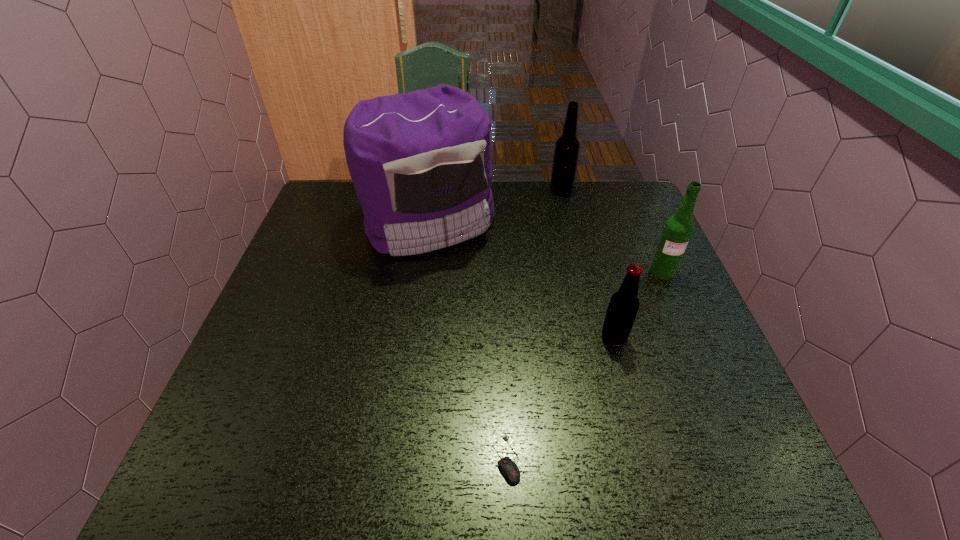
Where is `free space between the nearest object and the rightmost object`? free space between the nearest object and the rightmost object is located at coordinates (585, 365).

The height and width of the screenshot is (540, 960). I want to click on vacant region between the nearest beer bottle and the farthest beer bottle, so click(588, 264).

You are a GUI agent. You are given a task and a screenshot of the screen. Output one action in this format:
    pyautogui.click(x=<x>, y=<y>)
    Task: Click on the vacant region between the mouse and the rightmost beer bottle
    
    Given the screenshot: What is the action you would take?
    pyautogui.click(x=585, y=365)

Locate an element on the screen. The height and width of the screenshot is (540, 960). free space between the farthest beer bottle and the rightmost beer bottle is located at coordinates (612, 231).

Select which object is the closest to the shortest beer bottle. Please provide its 2D coordinates. Your answer should be formatted as a tuple, i.e. [(x, y)], where the tuple contains the x and y coordinates of a point satisfying the conditions above.

[(678, 229)]

Identify which object is the fourth nearest to the farthest beer bottle. Please provide its 2D coordinates. Your answer should be formatted as a tuple, i.e. [(x, y)], where the tuple contains the x and y coordinates of a point satisfying the conditions above.

[(510, 470)]

Locate which beer bottle ranks in proximity to the farthest beer bottle. Please provide its 2D coordinates. Your answer should be formatted as a tuple, i.e. [(x, y)], where the tuple contains the x and y coordinates of a point satisfying the conditions above.

[(678, 229)]

Where is `beer bottle that can be found as the closest to the shortest object`? The image size is (960, 540). beer bottle that can be found as the closest to the shortest object is located at coordinates (624, 304).

Where is `blank space that satisfies the following two spatial constraints: 1. on the front side of the farthest beer bottle; 2. on the right side of the shortest beer bottle`? blank space that satisfies the following two spatial constraints: 1. on the front side of the farthest beer bottle; 2. on the right side of the shortest beer bottle is located at coordinates (596, 337).

The image size is (960, 540). Identify the location of vacant region that satisfies the following two spatial constraints: 1. on the front pocket of the tallest object; 2. on the right side of the mouse. 396,459.